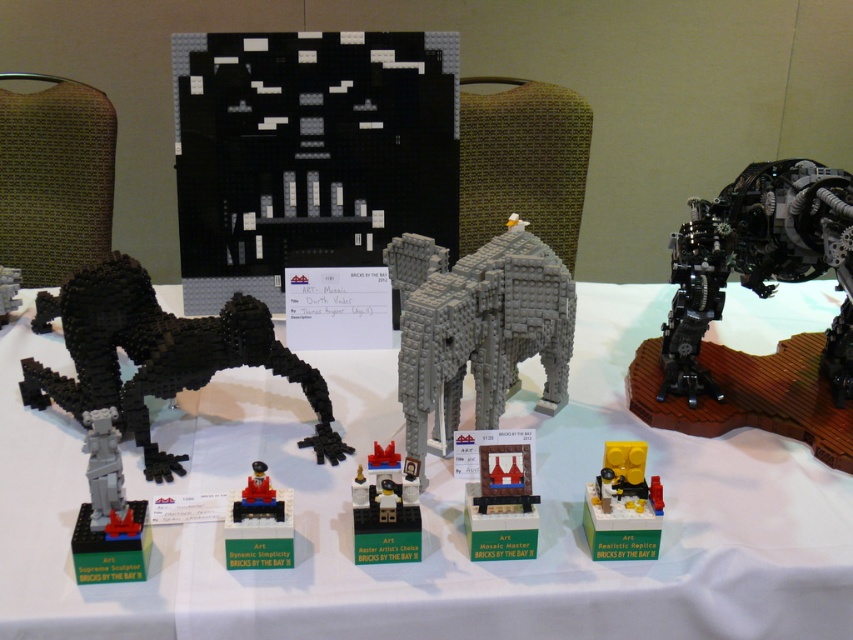
Is point (425, 195) more distant than point (146, 547)?

Yes, it is.

Which is behind, point (183, 282) or point (96, 410)?

Point (183, 282)

Does point (326, 93) come farther from viewer compared to point (91, 522)?

Yes, it is.

What are the coordinates of `black matte/dark gray darth vader at upper center` in the screenshot? It's located at (308, 154).

Who is more forward, (x=300, y=189) or (x=16, y=273)?

Point (x=300, y=189) is in front.

Between point (341, 250) and point (16, 301), which one is positioned behind?

The point (341, 250) is more distant.

Is point (273, 168) less distant than point (7, 291)?

Yes, it is.

The image size is (853, 640). Identify the location of black matte/dark gray darth vader at upper center. (308, 154).

Can you confirm if matte brick mosaic at center is bigger than red plastic car at center?

Yes.

Does point (529, 548) come behind point (289, 545)?

That is True.

Which is in front, point (509, 536) or point (292, 540)?

Point (292, 540) is in front.

Where is `matte brick mosaic at center`? matte brick mosaic at center is located at coordinates (498, 492).